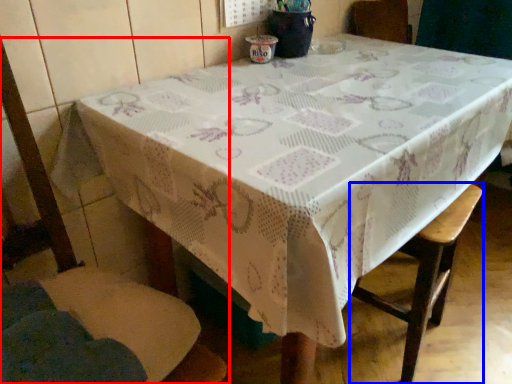
Question: Which object is further to the camera taking this photo, chair (highlighted by a red box) or bar stool (highlighted by a blue box)?

Choices:
 (A) chair
 (B) bar stool

Answer: (B)